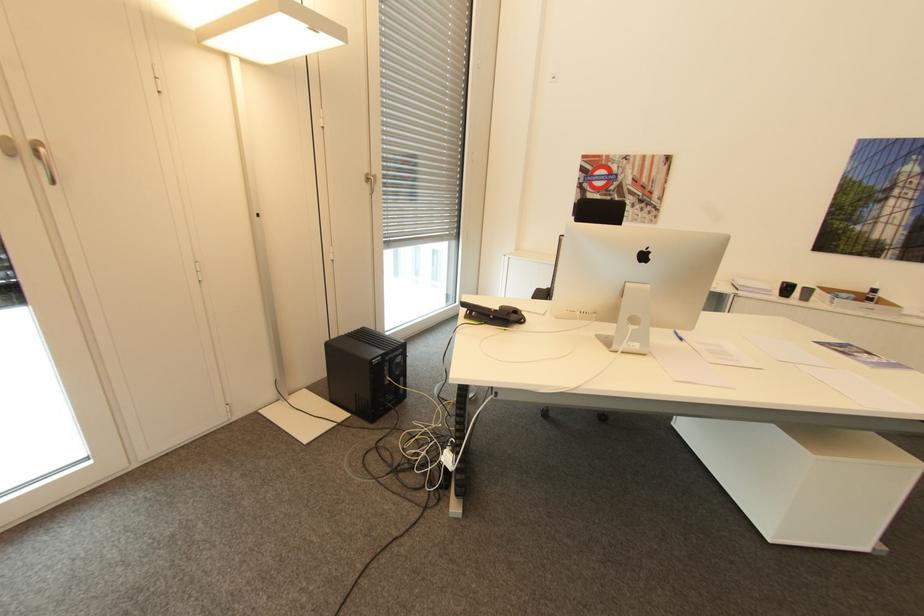
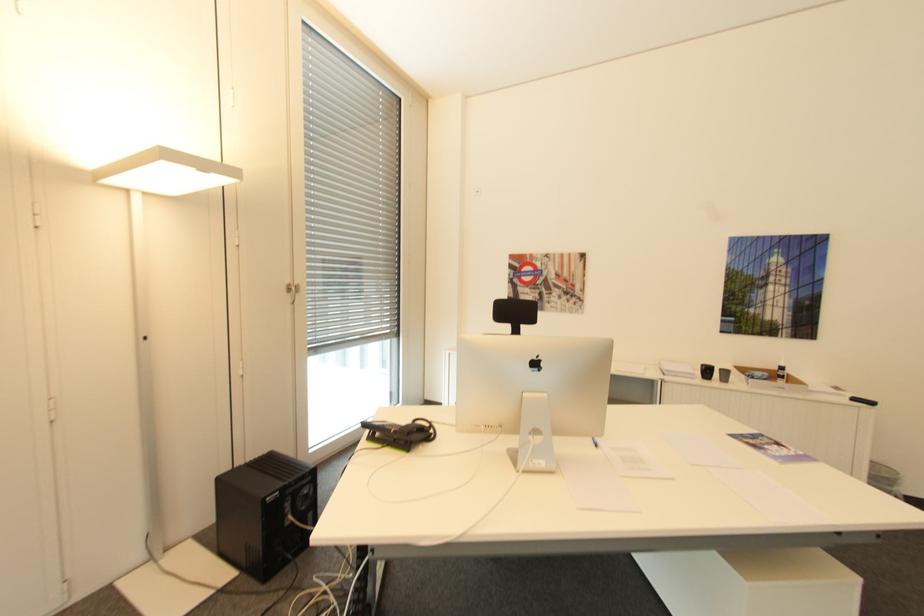
Question: How did the camera likely rotate?

Choices:
 (A) Left
 (B) Right
 (C) Up
 (D) Down

Answer: (C)